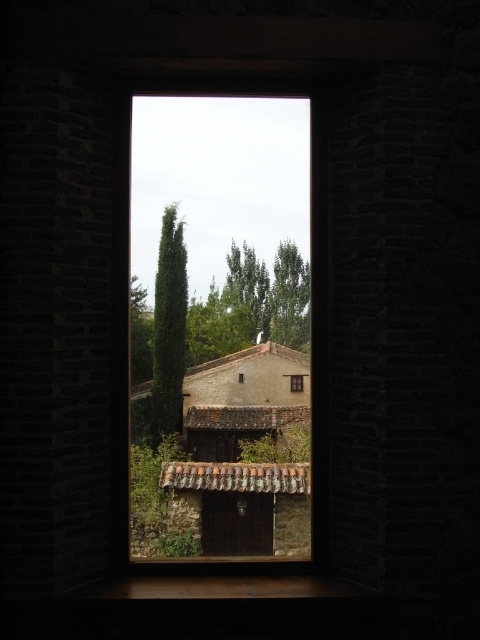
Is green leafy tree at upper center taller than matte brown wooden window at center?

Correct, green leafy tree at upper center is much taller as matte brown wooden window at center.

Which of these two, green leafy tree at upper center or matte brown wooden window at center, stands taller?

With more height is green leafy tree at upper center.

Is point (300, 298) in front of point (289, 380)?

Yes, point (300, 298) is in front of point (289, 380).

Image resolution: width=480 pixels, height=640 pixels. In order to click on green leafy tree at upper center in this screenshot , I will do `click(289, 298)`.

Can you confirm if green textured cypress tree at center is shorter than matte brown wooden window at center?

No.

How much distance is there between green textured cypress tree at center and matte brown wooden window at center?

green textured cypress tree at center is 28.92 inches from matte brown wooden window at center.

Find the location of a particular element. This screenshot has width=480, height=640. green textured cypress tree at center is located at coordinates (168, 326).

Does green textured cypress tree at center have a greater width compared to green leafy tree at upper center?

In fact, green textured cypress tree at center might be narrower than green leafy tree at upper center.

The width and height of the screenshot is (480, 640). What do you see at coordinates (168, 326) in the screenshot?
I see `green textured cypress tree at center` at bounding box center [168, 326].

The image size is (480, 640). I want to click on green textured cypress tree at center, so click(x=168, y=326).